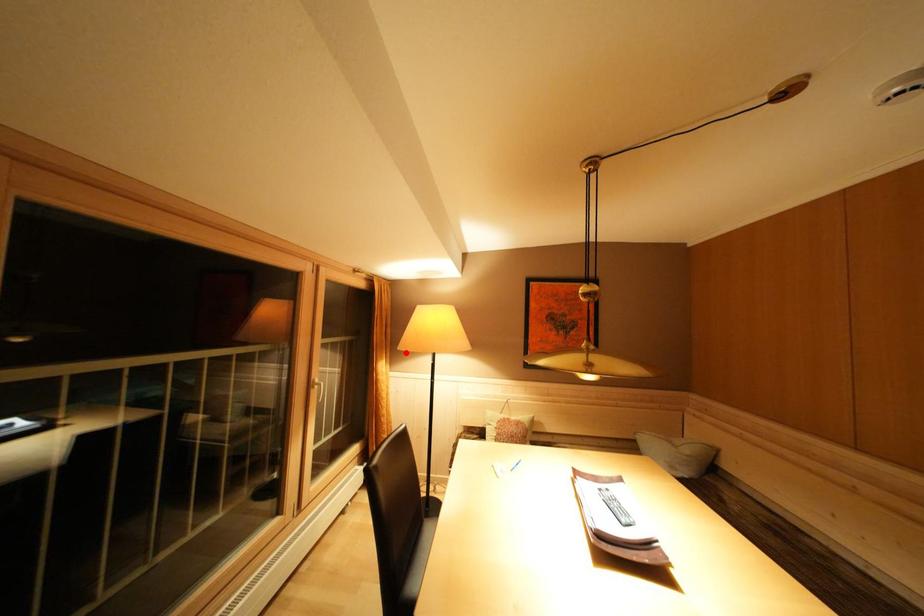
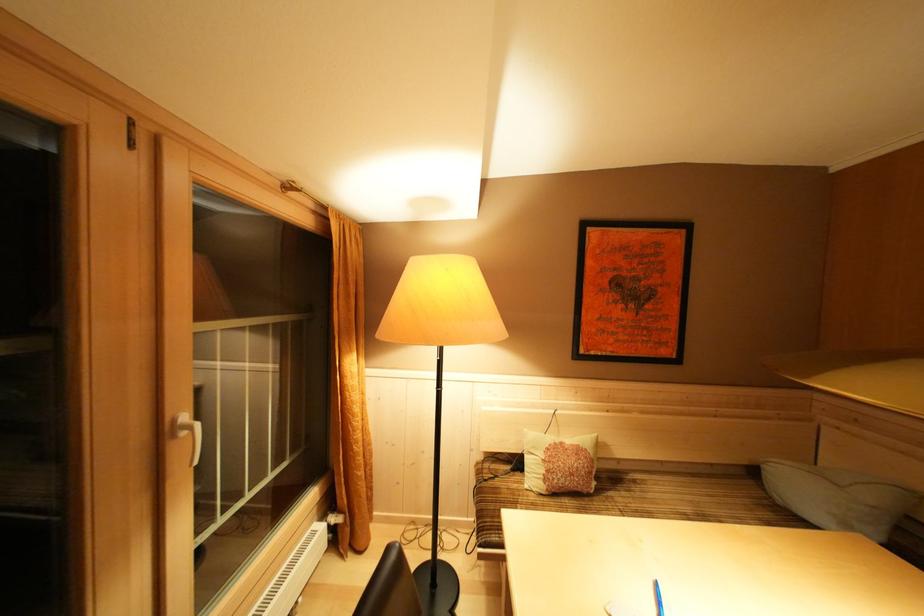
The point at the highlighted location is marked in the first image. Where is the corresponding point in the second image?

(385, 339)